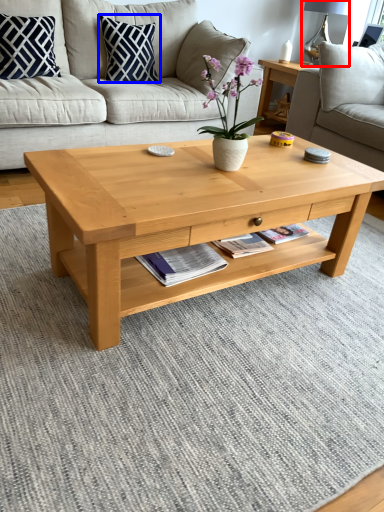
Question: Which point is further to the camera, lamp (highlighted by a red box) or pillow (highlighted by a blue box)?

Choices:
 (A) lamp
 (B) pillow

Answer: (A)